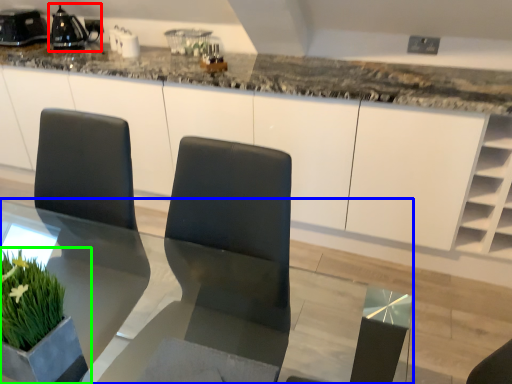
Question: Considering the real-world distances, which object is closest to appliance (highlighted by a red box)? table (highlighted by a blue box) or houseplant (highlighted by a green box).

Choices:
 (A) table
 (B) houseplant

Answer: (A)